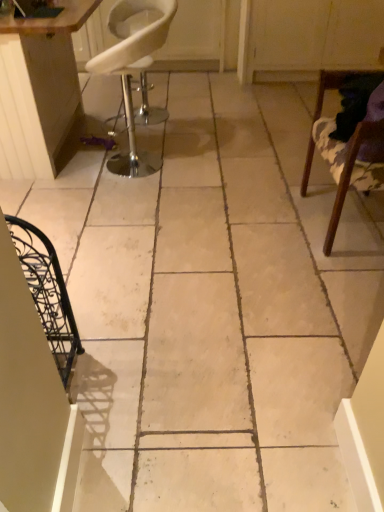
You are a GUI agent. You are given a task and a screenshot of the screen. Output one action in this format:
    pyautogui.click(x=<x>, y=<y>)
    Task: Click on the vacant space behind wooden chair at right, acting as the first chair starting from the right
    The image size is (384, 512).
    Given the screenshot: What is the action you would take?
    pyautogui.click(x=286, y=175)